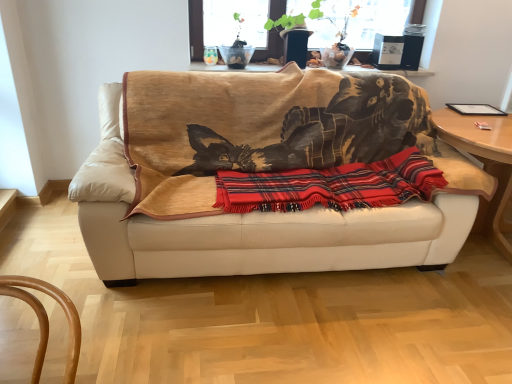
Question: Is the depth of wooden round table at right, arranged as the first table when ordered from the bottom, less than that of wooden table at upper center, which is counted as the first table, starting from the left?

Choices:
 (A) no
 (B) yes

Answer: (B)

Question: Does wooden round table at right, arranged as the first table when ordered from the bottom, turn towards wooden table at upper center, the second table when ordered from right to left?

Choices:
 (A) no
 (B) yes

Answer: (A)

Question: Is wooden round table at right, which is counted as the 2th table, starting from the left, facing away from wooden table at upper center, placed as the second table when sorted from bottom to top?

Choices:
 (A) no
 (B) yes

Answer: (A)

Question: From a real-world perspective, is wooden round table at right, which is counted as the 2th table, starting from the left, on wooden table at upper center, the second table when ordered from right to left?

Choices:
 (A) no
 (B) yes

Answer: (A)

Question: From the image's perspective, is wooden round table at right, arranged as the first table when ordered from the bottom, on top of wooden table at upper center, placed as the second table when sorted from bottom to top?

Choices:
 (A) yes
 (B) no

Answer: (B)

Question: Is wooden round table at right, arranged as the first table when ordered from the bottom, further to camera compared to wooden table at upper center, which is counted as the first table, starting from the left?

Choices:
 (A) no
 (B) yes

Answer: (A)

Question: Is wooden round table at right, which is counted as the 2th table, starting from the left, in front of beige leather couch at center?

Choices:
 (A) no
 (B) yes

Answer: (A)

Question: Is wooden round table at right, arranged as the first table when ordered from the bottom, to the left of beige leather couch at center from the viewer's perspective?

Choices:
 (A) no
 (B) yes

Answer: (A)

Question: Is wooden round table at right, which is counted as the 2th table, starting from the left, wider than beige leather couch at center?

Choices:
 (A) no
 (B) yes

Answer: (B)

Question: From a real-world perspective, is wooden round table at right, which is counted as the 2th table, starting from the left, on beige leather couch at center?

Choices:
 (A) yes
 (B) no

Answer: (B)

Question: Considering the relative sizes of wooden round table at right, the 1th table when ordered from right to left, and beige leather couch at center in the image provided, is wooden round table at right, the 1th table when ordered from right to left, thinner than beige leather couch at center?

Choices:
 (A) yes
 (B) no

Answer: (B)

Question: Would you say beige leather couch at center is part of wooden round table at right, the 1th table when ordered from right to left,'s contents?

Choices:
 (A) no
 (B) yes

Answer: (A)